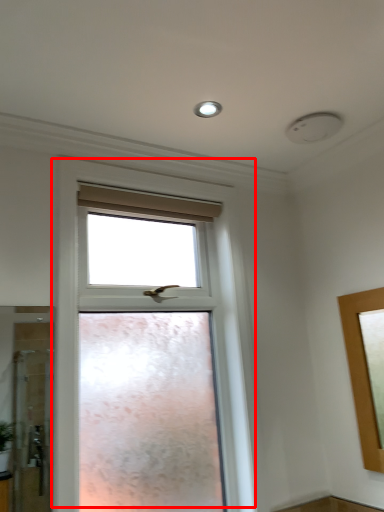
Question: Considering the relative positions of window (annotated by the red box) and lighting in the image provided, where is window (annotated by the red box) located with respect to the staircase?

Choices:
 (A) left
 (B) right

Answer: (A)